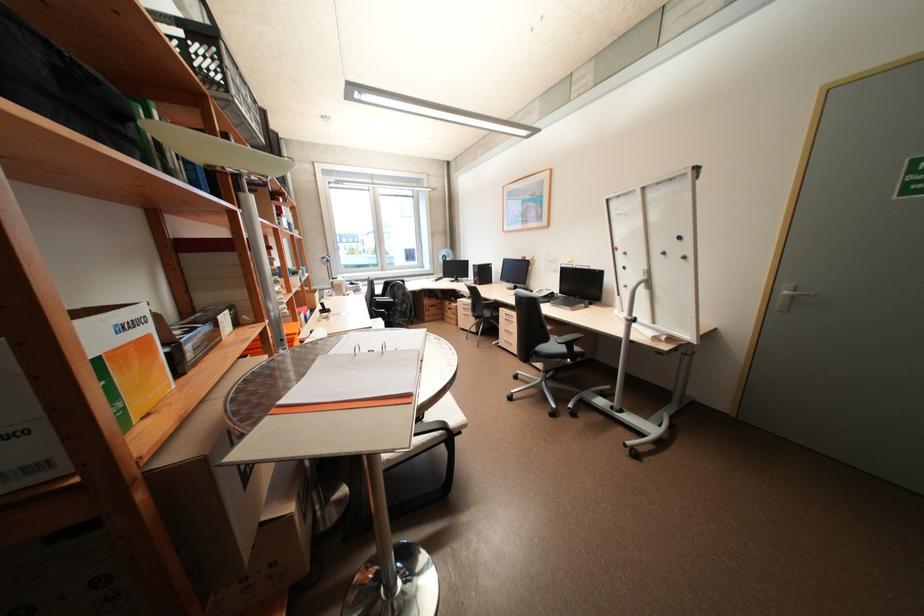
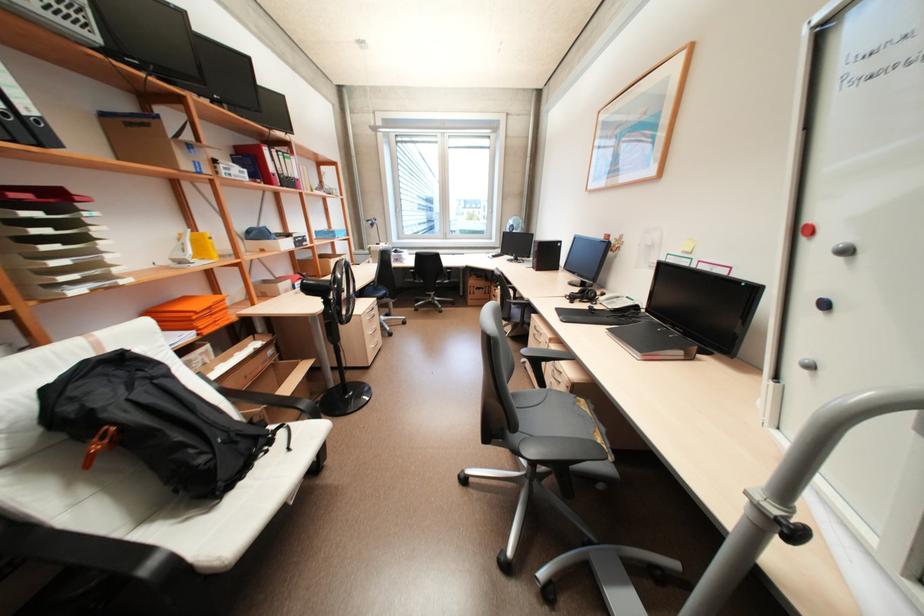
Locate, in the second image, the point that corresponds to [629,267] in the first image.

(830, 304)